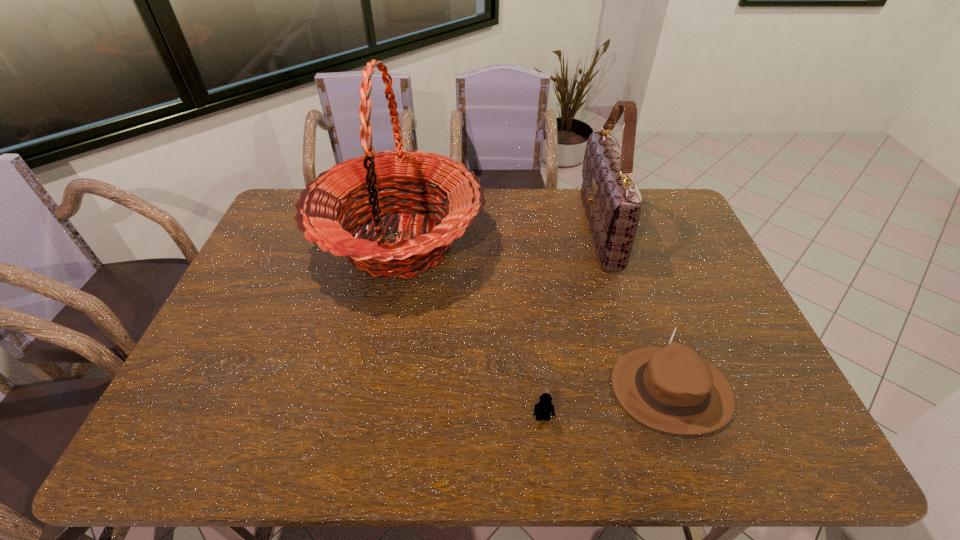
I want to click on vacant area that lies between the tallest object and the third shortest object, so click(x=499, y=237).

This screenshot has height=540, width=960. Identify the location of empty space that is in between the leftmost object and the handbag. (499, 237).

I want to click on vacant area between the handbag and the Lego, so 571,323.

Where is `free spot between the Lego and the fedora`? This screenshot has width=960, height=540. free spot between the Lego and the fedora is located at coordinates (607, 403).

Where is `vacant space that is in between the leftmost object and the second tallest object`? vacant space that is in between the leftmost object and the second tallest object is located at coordinates (499, 237).

At what (x,y) coordinates should I click in order to perform the action: click on vacant region between the leftmost object and the fedora. Please return your answer as a coordinate pair (x, y). The image size is (960, 540). Looking at the image, I should click on (536, 316).

Image resolution: width=960 pixels, height=540 pixels. Identify the location of object that is the closest to the shortest object. (671, 388).

Point out which object is positioned as the third nearest to the Lego. Please provide its 2D coordinates. Your answer should be formatted as a tuple, i.e. [(x, y)], where the tuple contains the x and y coordinates of a point satisfying the conditions above.

[(612, 201)]

The width and height of the screenshot is (960, 540). I want to click on vacant area in the image that satisfies the following two spatial constraints: 1. on the feather side of the fedora; 2. on the front-facing side of the second object from left to right, so click(681, 418).